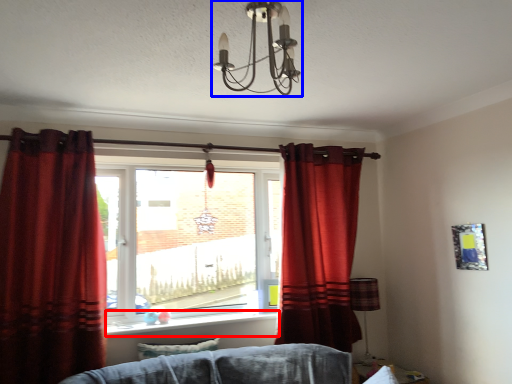
Question: Which object appears closest to the camera in this image, window sill (highlighted by a red box) or light fixture (highlighted by a blue box)?

Choices:
 (A) window sill
 (B) light fixture

Answer: (B)